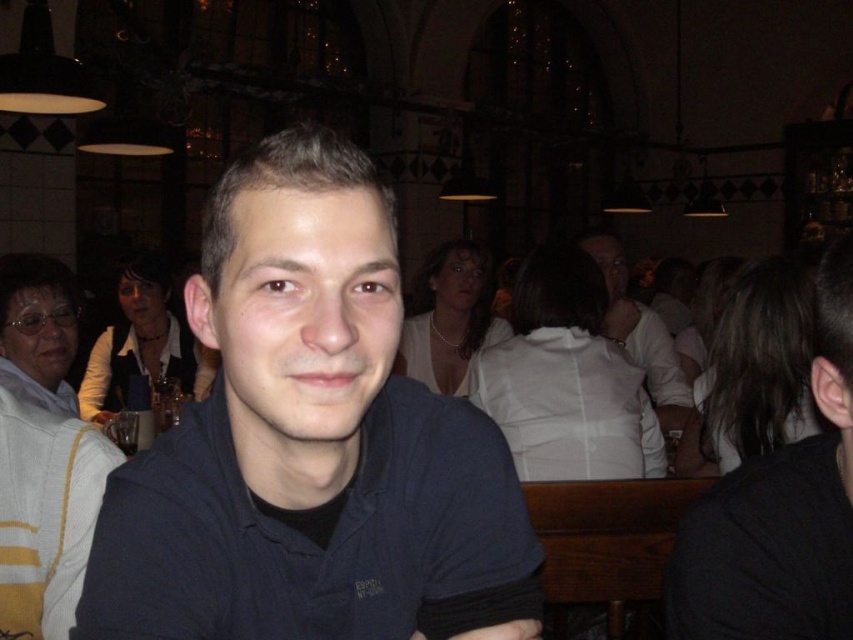
You are a photographer standing at the entrance of the restaurant. You want to take a photo of the dark blue shirt at center and the white matte shirt at center. If your camera has a maximum focus range of 7 feet, will both shirts be in focus?

The dark blue shirt at center is 6.97 feet away from the white matte shirt at center. Since the distance between them is within the camera maximum focus range of 7 feet, both shirts will be in focus.

Based on the photo, you are a photographer at the event and want to capture a photo of the dark blue shirt at center and the white matte shirt at center. Which shirt should you focus on first if you need to capture them from left to right?

The dark blue shirt at center should be focused on first since it is positioned to the left of the white matte shirt at center, so when capturing from left to right, you should start with the dark blue shirt at center.

You are a photographer setting up for an event and notice two people in the center of the scene wearing dark blue shirt at center and white matte shirt at center. Which of these two shirts is shorter in height?

The dark blue shirt at center is not as tall as white matte shirt at center, so the dark blue shirt at center is shorter in height.